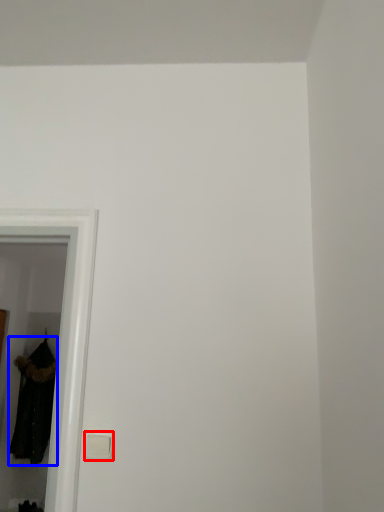
Question: Which of the following is the farthest to the observer, light switch (highlighted by a red box) or clothing (highlighted by a blue box)?

Choices:
 (A) light switch
 (B) clothing

Answer: (B)